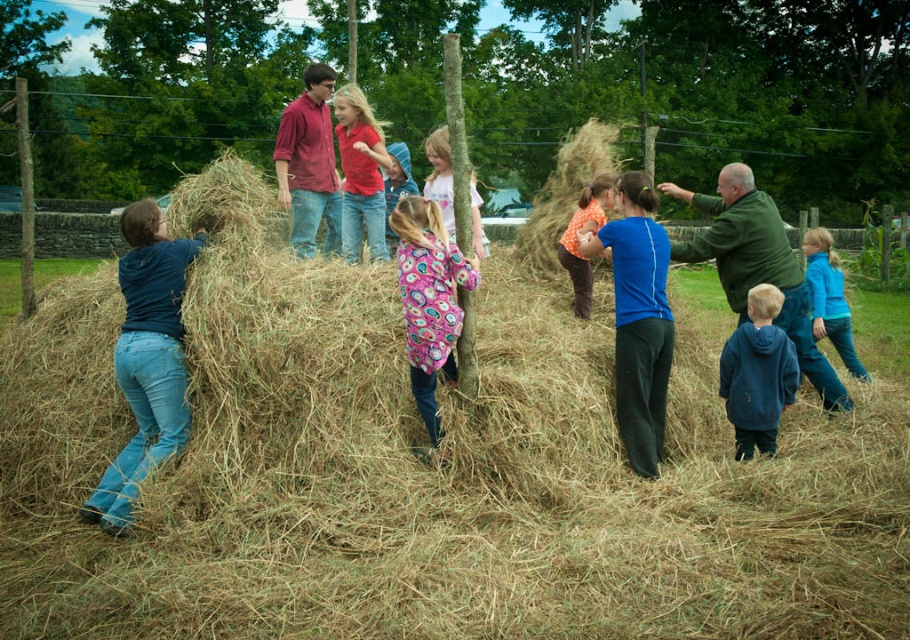
You are a photographer trying to capture a photo of the blue fleece jacket at right and the orange cotton shirt at center. If you want to ensure both are fully visible in the frame, which one should you focus on first?

The blue fleece jacket at right is shorter than the orange cotton shirt at center, so you should focus on the orange cotton shirt at center first to ensure it is fully visible in the frame.